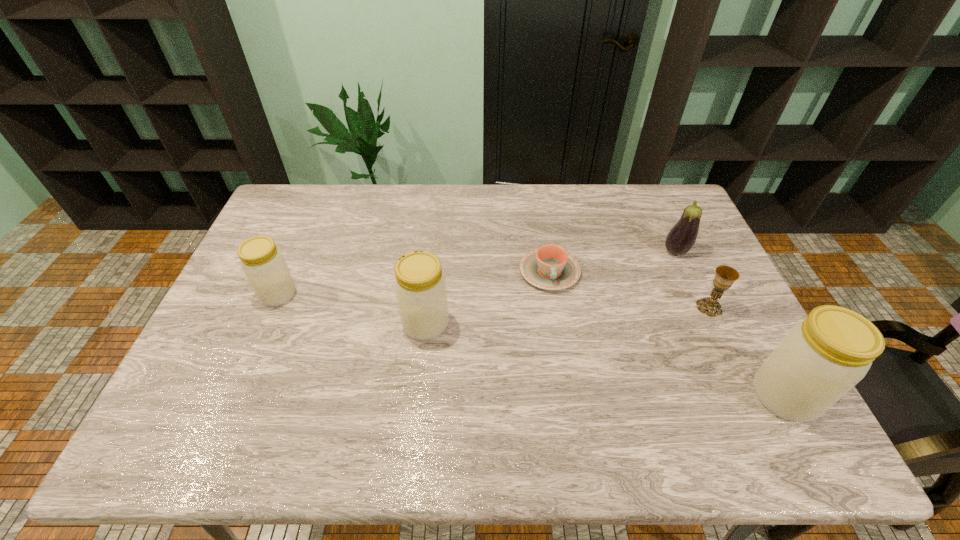
You are a GUI agent. You are given a task and a screenshot of the screen. Output one action in this format:
    pyautogui.click(x=<x>, y=<y>)
    Task: Click on the leftmost jar
    This screenshot has width=960, height=540.
    Given the screenshot: What is the action you would take?
    pyautogui.click(x=263, y=264)

At what (x,y) coordinates should I click in order to perform the action: click on the leftmost object. Please return your answer as a coordinate pair (x, y). Looking at the image, I should click on (263, 264).

Locate an element on the screen. the fifth object from right to left is located at coordinates (420, 288).

The height and width of the screenshot is (540, 960). I want to click on the second jar from right to left, so pyautogui.click(x=420, y=288).

Image resolution: width=960 pixels, height=540 pixels. I want to click on the nearest jar, so click(820, 359).

You are a GUI agent. You are given a task and a screenshot of the screen. Output one action in this format:
    pyautogui.click(x=<x>, y=<y>)
    Task: Click on the rightmost jar
    
    Given the screenshot: What is the action you would take?
    820,359

This screenshot has width=960, height=540. What are the coordinates of `eggplant` in the screenshot? It's located at (681, 238).

You are a GUI agent. You are given a task and a screenshot of the screen. Output one action in this format:
    pyautogui.click(x=<x>, y=<y>)
    Task: Click on the shortest object
    Image resolution: width=960 pixels, height=540 pixels.
    Given the screenshot: What is the action you would take?
    pyautogui.click(x=550, y=267)

Where is `chinaware`? Image resolution: width=960 pixels, height=540 pixels. chinaware is located at coordinates (550, 267).

The width and height of the screenshot is (960, 540). In order to click on chalice in this screenshot , I will do `click(725, 276)`.